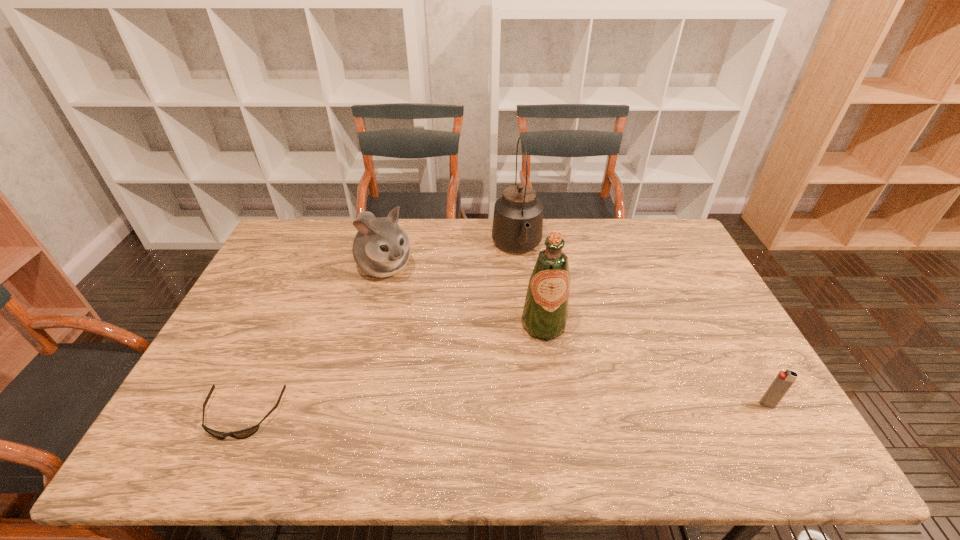
You are a GUI agent. You are given a task and a screenshot of the screen. Output one action in this format:
    pyautogui.click(x=<x>, y=<y>)
    Task: Click on the leftmost object
    The image size is (960, 540).
    Given the screenshot: What is the action you would take?
    pyautogui.click(x=245, y=433)

This screenshot has width=960, height=540. I want to click on sunglasses, so click(x=245, y=433).

Where is `igniter`? This screenshot has height=540, width=960. igniter is located at coordinates (784, 380).

Identify the location of the rightmost object. This screenshot has width=960, height=540. (784, 380).

Find the location of a particular element. This screenshot has width=960, height=540. hamster is located at coordinates (381, 248).

In order to click on the third shortest object in this screenshot , I will do `click(381, 248)`.

Identify the location of kettle. (517, 226).

Image resolution: width=960 pixels, height=540 pixels. What are the coordinates of `olive oil` in the screenshot? It's located at (545, 312).

Identify the location of the second tallest object. (545, 312).

You are a GUI agent. You are given a task and a screenshot of the screen. Output one action in this format:
    pyautogui.click(x=<x>, y=<y>)
    Task: Click on the free space located on the left of the fourth tallest object
    This screenshot has width=960, height=540.
    Given the screenshot: What is the action you would take?
    pyautogui.click(x=602, y=404)